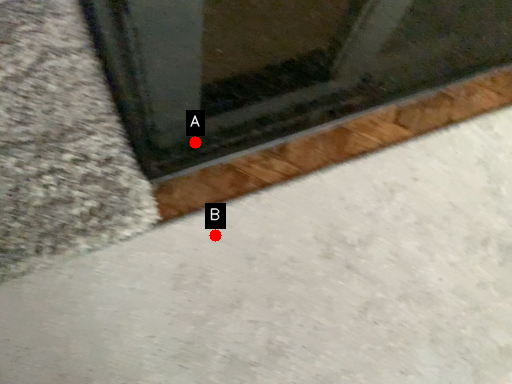
Question: Two points are circled on the image, labeled by A and B beside each circle. Which point is closer to the camera taking this photo?

Choices:
 (A) A is closer
 (B) B is closer

Answer: (B)